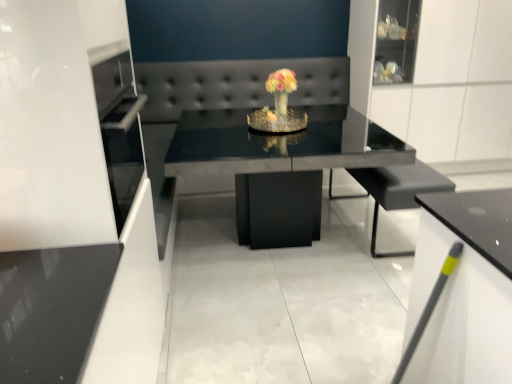
Measure the distance between glossy black table at center and camera.

glossy black table at center is 10.33 feet from camera.

I want to click on pastel yellow fabric flower at center, so point(281,91).

The image size is (512, 384). What are the coordinates of `black matte armchair at center` in the screenshot? It's located at (398, 191).

Is pastel yellow fabric flower at center oriented towards black matte armchair at center?

No, pastel yellow fabric flower at center is not oriented towards black matte armchair at center.

Does pastel yellow fabric flower at center have a lesser height compared to black matte armchair at center?

Yes, pastel yellow fabric flower at center is shorter than black matte armchair at center.

Considering the relative positions of pastel yellow fabric flower at center and black matte armchair at center in the image provided, is pastel yellow fabric flower at center in front of black matte armchair at center?

No, it is behind black matte armchair at center.

Is black matte armchair at center facing away from black leather couch at center?

No, black matte armchair at center is not facing away from black leather couch at center.

Are black matte armchair at center and black leather couch at center making contact?

black matte armchair at center and black leather couch at center are not in contact.

This screenshot has width=512, height=384. Identify the location of couch above the black matte armchair at center (from a real-world perspective). (226, 93).

Looking at this image, between black matte armchair at center and black leather couch at center, which one has larger width?

Wider between the two is black leather couch at center.

Is black leather couch at center positioned before glossy black table at center?

No, it is behind glossy black table at center.

Is black leather couch at center spatially inside glossy black table at center, or outside of it?

black leather couch at center is not inside glossy black table at center, it's outside.

Is black leather couch at center with glossy black table at center?

They are not placed beside each other.

Which of these two, black leather couch at center or glossy black table at center, is wider?

With larger width is glossy black table at center.

In the scene shown: From the image's perspective, is white glossy cabinet at lower right beneath black leather couch at center?

Yes, from the image's perspective, white glossy cabinet at lower right is beneath black leather couch at center.

What's the angular difference between white glossy cabinet at lower right and black leather couch at center's facing directions?

105 degrees separate the facing orientations of white glossy cabinet at lower right and black leather couch at center.

You are a GUI agent. You are given a task and a screenshot of the screen. Output one action in this format:
    pyautogui.click(x=<x>, y=<y>)
    Task: Click on the couch that is behind the white glossy cabinet at lower right
    This screenshot has height=384, width=512.
    Given the screenshot: What is the action you would take?
    [226, 93]

Based on the photo, can you confirm if white glossy cabinet at lower right is positioned to the right of black leather couch at center?

Yes.

Considering the sizes of objects pastel yellow fabric flower at center and white glossy cabinet at lower right in the image provided, who is thinner, pastel yellow fabric flower at center or white glossy cabinet at lower right?

Thinner between the two is pastel yellow fabric flower at center.

From their relative heights in the image, would you say pastel yellow fabric flower at center is taller or shorter than white glossy cabinet at lower right?

In the image, pastel yellow fabric flower at center appears to be shorter than white glossy cabinet at lower right.

Is pastel yellow fabric flower at center oriented away from white glossy cabinet at lower right?

No, white glossy cabinet at lower right is not at the back of pastel yellow fabric flower at center.

Is pastel yellow fabric flower at center situated inside white glossy cabinet at lower right or outside?

pastel yellow fabric flower at center lies outside white glossy cabinet at lower right.

From a real-world perspective, relative to pastel yellow fabric flower at center, is black leather couch at center vertically above or below?

From a real-world perspective, black leather couch at center is physically below pastel yellow fabric flower at center.

Between black leather couch at center and pastel yellow fabric flower at center, which one appears on the left side from the viewer's perspective?

From the viewer's perspective, black leather couch at center appears more on the left side.

Is black leather couch at center not close to pastel yellow fabric flower at center?

Actually, black leather couch at center and pastel yellow fabric flower at center are a little close together.

Is the position of black leather couch at center more distant than that of pastel yellow fabric flower at center?

Yes, it is behind pastel yellow fabric flower at center.

From the image's perspective, which object appears higher, pastel yellow fabric flower at center or black leather couch at center?

From the image's view, pastel yellow fabric flower at center is above.

Measure the distance between pastel yellow fabric flower at center and black leather couch at center.

They are 27.78 inches apart.

Image resolution: width=512 pixels, height=384 pixels. I want to click on couch on the left of pastel yellow fabric flower at center, so click(x=226, y=93).

Is pastel yellow fabric flower at center not close to black leather couch at center?

That's not correct — pastel yellow fabric flower at center is a little close to black leather couch at center.

Where is `floral arrangement on the left of black matte armchair at center`? floral arrangement on the left of black matte armchair at center is located at coordinates (281, 91).

What are the coordinates of `couch lying behind the black matte armchair at center` in the screenshot? It's located at (226, 93).

Which object lies nearer to the anchor point black matte armchair at center, black leather couch at center or pastel yellow fabric flower at center?

pastel yellow fabric flower at center is closer to black matte armchair at center.

Which object lies nearer to the anchor point glossy black table at center, white glossy cabinet at lower right or black matte armchair at center?

black matte armchair at center is positioned closer to the anchor glossy black table at center.

Estimate the real-world distances between objects in this image. Which object is closer to pastel yellow fabric flower at center, black leather couch at center or white glossy cabinet at lower right?

black leather couch at center is positioned closer to the anchor pastel yellow fabric flower at center.

Which object lies nearer to the anchor point black matte armchair at center, white glossy cabinet at lower right or black leather couch at center?

The object closer to black matte armchair at center is white glossy cabinet at lower right.

From the image, which object appears to be farther from black matte armchair at center, glossy black table at center or white glossy cabinet at lower right?

white glossy cabinet at lower right is positioned further to the anchor black matte armchair at center.

Looking at the image, which one is located further to white glossy cabinet at lower right, black matte armchair at center or glossy black table at center?

Among the two, glossy black table at center is located further to white glossy cabinet at lower right.

When comparing their distances from white glossy cabinet at lower right, does glossy black table at center or black leather couch at center seem closer?

Based on the image, glossy black table at center appears to be nearer to white glossy cabinet at lower right.

Looking at the image, which one is located further to pastel yellow fabric flower at center, black leather couch at center or glossy black table at center?

glossy black table at center is positioned further to the anchor pastel yellow fabric flower at center.

Locate an element on the screen. The image size is (512, 384). table positioned between white glossy cabinet at lower right and pastel yellow fabric flower at center from near to far is located at coordinates (279, 144).

What are the coordinates of `floral arrangement between white glossy cabinet at lower right and black leather couch at center from front to back` in the screenshot? It's located at (281, 91).

Locate an element on the screen. This screenshot has width=512, height=384. armchair positioned between white glossy cabinet at lower right and black leather couch at center from near to far is located at coordinates (398, 191).

I want to click on armchair between glossy black table at center and black leather couch at center along the z-axis, so click(x=398, y=191).